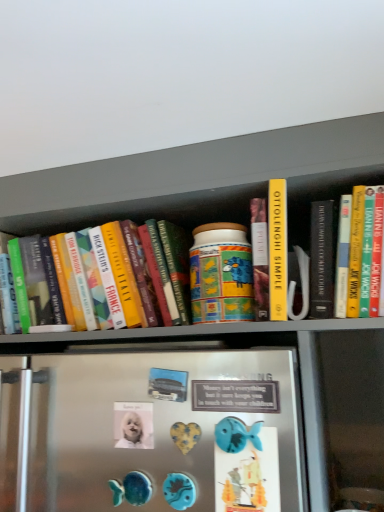
Measure the distance between point (114, 272) and camera.

They are 38.15 inches apart.

This screenshot has width=384, height=512. What do you see at coordinates (133, 425) in the screenshot?
I see `white glossy button at center, which ranks as the second button in right-to-left order` at bounding box center [133, 425].

Locate an element on the screen. This screenshot has height=512, width=384. white glossy button at center, arranged as the 2th button when viewed from the front is located at coordinates (133, 425).

The image size is (384, 512). What do you see at coordinates (249, 474) in the screenshot? I see `blue plastic fish at lower center, the 2th button when ordered from left to right` at bounding box center [249, 474].

Measure the distance between blue plastic fish at lower center, which is counted as the first button, starting from the front, and camera.

The depth of blue plastic fish at lower center, which is counted as the first button, starting from the front, is 26.02 inches.

Where is `hardcover book at left`? The image size is (384, 512). hardcover book at left is located at coordinates (142, 270).

Is point (142, 238) behind point (265, 453)?

Yes, it is behind point (265, 453).

Based on their positions, is hardcover book at left located to the left or right of blue plastic fish at lower center, placed as the 1th button when sorted from right to left?

Clearly, hardcover book at left is on the left of blue plastic fish at lower center, placed as the 1th button when sorted from right to left, in the image.

From the image's perspective, count 2nd buttons downward from the hardcover book at left and point to it. Please provide its 2D coordinates.

[(249, 474)]

Is hardcover book at left looking in the opposite direction of blue plastic fish at lower center, which is counted as the first button, starting from the front?

No.

Which of these two, white glossy button at center, which ranks as the first button in left-to-right order, or hardcover book at left, is thinner?

white glossy button at center, which ranks as the first button in left-to-right order.

Considering the sizes of objects white glossy button at center, which ranks as the first button in left-to-right order, and hardcover book at left in the image provided, who is bigger, white glossy button at center, which ranks as the first button in left-to-right order, or hardcover book at left?

hardcover book at left.

Is white glossy button at center, placed as the 1th button when sorted from back to front, not inside hardcover book at left?

Yes, white glossy button at center, placed as the 1th button when sorted from back to front, is outside of hardcover book at left.

Consider the image. Is white glossy button at center, arranged as the 2th button when viewed from the front, turned away from hardcover book at left?

No, white glossy button at center, arranged as the 2th button when viewed from the front,'s orientation is not away from hardcover book at left.

Is blue plastic fish at lower center, which is counted as the first button, starting from the front, in front of or behind white glossy button at center, placed as the 1th button when sorted from back to front, in the image?

blue plastic fish at lower center, which is counted as the first button, starting from the front, is positioned closer to the viewer than white glossy button at center, placed as the 1th button when sorted from back to front.

Is blue plastic fish at lower center, which is the second button in back-to-front order, turned away from white glossy button at center, which ranks as the second button in right-to-left order?

blue plastic fish at lower center, which is the second button in back-to-front order, is not turned away from white glossy button at center, which ranks as the second button in right-to-left order.

Which of these two, blue plastic fish at lower center, placed as the 1th button when sorted from right to left, or white glossy button at center, which ranks as the first button in left-to-right order, is smaller?

white glossy button at center, which ranks as the first button in left-to-right order, is smaller.

From a real-world perspective, is blue plastic fish at lower center, which is counted as the first button, starting from the front, positioned above or below white glossy button at center, arranged as the 2th button when viewed from the front?

In terms of real-world spatial position, blue plastic fish at lower center, which is counted as the first button, starting from the front, is below white glossy button at center, arranged as the 2th button when viewed from the front.

In the scene shown: Is blue plastic fish at lower center, which is the second button in back-to-front order, inside or outside of hardcover book at left?

blue plastic fish at lower center, which is the second button in back-to-front order, is located beyond the bounds of hardcover book at left.

Can you confirm if blue plastic fish at lower center, placed as the 1th button when sorted from right to left, is positioned to the right of hardcover book at left?

Correct, you'll find blue plastic fish at lower center, placed as the 1th button when sorted from right to left, to the right of hardcover book at left.

Consider the image. Which of these two, blue plastic fish at lower center, placed as the 1th button when sorted from right to left, or hardcover book at left, is smaller?

blue plastic fish at lower center, placed as the 1th button when sorted from right to left.

What's the angular difference between white glossy button at center, arranged as the 2th button when viewed from the front, and blue plastic fish at lower center, which is the second button in back-to-front order,'s facing directions?

There is a 1.41-degree angle between the facing directions of white glossy button at center, arranged as the 2th button when viewed from the front, and blue plastic fish at lower center, which is the second button in back-to-front order.

Is white glossy button at center, arranged as the 2th button when viewed from the front, positioned with its back to blue plastic fish at lower center, which is the second button in back-to-front order?

white glossy button at center, arranged as the 2th button when viewed from the front, does not have its back to blue plastic fish at lower center, which is the second button in back-to-front order.

Which of these two, white glossy button at center, which ranks as the first button in left-to-right order, or blue plastic fish at lower center, which is the second button in back-to-front order, is wider?

With larger width is white glossy button at center, which ranks as the first button in left-to-right order.

Relative to blue plastic fish at lower center, which is counted as the first button, starting from the front, is white glossy button at center, which ranks as the second button in right-to-left order, in front or behind?

In the image, white glossy button at center, which ranks as the second button in right-to-left order, appears behind blue plastic fish at lower center, which is counted as the first button, starting from the front.

Is there a large distance between hardcover book at left and white glossy button at center, placed as the 1th button when sorted from back to front?

They are positioned close to each other.

Which of these two, hardcover book at left or white glossy button at center, which ranks as the first button in left-to-right order, is bigger?

Bigger between the two is hardcover book at left.

Considering the sizes of hardcover book at left and white glossy button at center, which ranks as the second button in right-to-left order, in the image, is hardcover book at left wider or thinner than white glossy button at center, which ranks as the second button in right-to-left order,?

Considering their sizes, hardcover book at left looks broader than white glossy button at center, which ranks as the second button in right-to-left order.

Which object is positioned more to the left, hardcover book at left or white glossy button at center, which ranks as the second button in right-to-left order?

hardcover book at left.

Locate an element on the screen. Image resolution: width=384 pixels, height=512 pixels. book located above the blue plastic fish at lower center, the 2th button when ordered from left to right (from a real-world perspective) is located at coordinates (142, 270).

Locate an element on the screen. Image resolution: width=384 pixels, height=512 pixels. the 1st button in front of the hardcover book at left is located at coordinates pyautogui.click(x=133, y=425).

When comparing their distances from white glossy button at center, placed as the 1th button when sorted from back to front, does blue plastic fish at lower center, the 2th button when ordered from left to right, or hardcover book at left seem closer?

Based on the image, blue plastic fish at lower center, the 2th button when ordered from left to right, appears to be nearer to white glossy button at center, placed as the 1th button when sorted from back to front.

Based on their spatial positions, is white glossy button at center, which ranks as the second button in right-to-left order, or blue plastic fish at lower center, the 2th button when ordered from left to right, further from hardcover book at left?

blue plastic fish at lower center, the 2th button when ordered from left to right, lies further to hardcover book at left than the other object.

Based on their spatial positions, is hardcover book at left or blue plastic fish at lower center, placed as the 1th button when sorted from right to left, further from white glossy button at center, placed as the 1th button when sorted from back to front?

hardcover book at left is further to white glossy button at center, placed as the 1th button when sorted from back to front.

Looking at the image, which one is located closer to blue plastic fish at lower center, the 2th button when ordered from left to right, hardcover book at left or white glossy button at center, which ranks as the first button in left-to-right order?

white glossy button at center, which ranks as the first button in left-to-right order, is closer to blue plastic fish at lower center, the 2th button when ordered from left to right.

Considering their positions, is blue plastic fish at lower center, placed as the 1th button when sorted from right to left, positioned further to hardcover book at left than white glossy button at center, placed as the 1th button when sorted from back to front?

blue plastic fish at lower center, placed as the 1th button when sorted from right to left, is positioned further to the anchor hardcover book at left.

Considering their positions, is white glossy button at center, which ranks as the first button in left-to-right order, positioned further to blue plastic fish at lower center, which is counted as the first button, starting from the front, than hardcover book at left?

The object further to blue plastic fish at lower center, which is counted as the first button, starting from the front, is hardcover book at left.

Where is `button situated between hardcover book at left and blue plastic fish at lower center, which is counted as the first button, starting from the front, from left to right`? button situated between hardcover book at left and blue plastic fish at lower center, which is counted as the first button, starting from the front, from left to right is located at coordinates (133, 425).